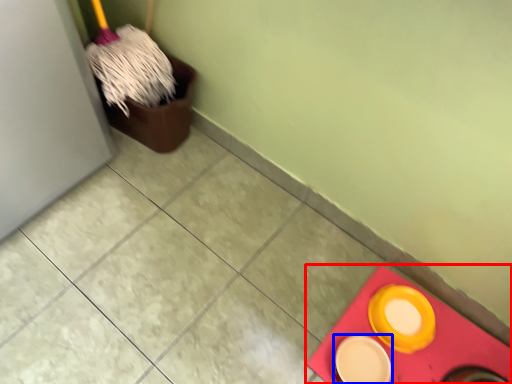
Question: Which object appears closest to the camera in this image, tile (highlighted by a red box) or tableware (highlighted by a blue box)?

Choices:
 (A) tile
 (B) tableware

Answer: (A)